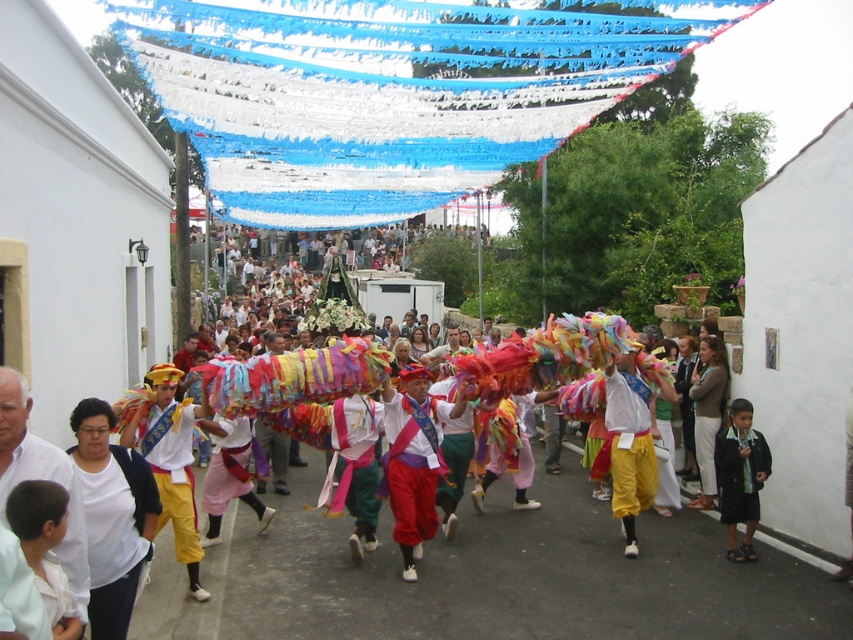
Question: Is multicolored fabric at center wider than dark blue fabric at lower right?

Choices:
 (A) no
 (B) yes

Answer: (B)

Question: Can you confirm if white cotton shirt at lower left is bigger than dark blue fabric at lower right?

Choices:
 (A) yes
 (B) no

Answer: (A)

Question: Which of the following is the farthest from the observer?

Choices:
 (A) multicolored fabric at center
 (B) white cotton shirt at lower left

Answer: (B)

Question: Based on their relative distances, which object is farther from the white cotton shirt at lower left?

Choices:
 (A) dark blue fabric at lower right
 (B) multicolored fabric at center

Answer: (A)

Question: Which of the following is the closest to the observer?

Choices:
 (A) (761, 461)
 (B) (74, 422)

Answer: (B)

Question: Is multicolored fabric at center smaller than dark blue fabric at lower right?

Choices:
 (A) yes
 (B) no

Answer: (B)